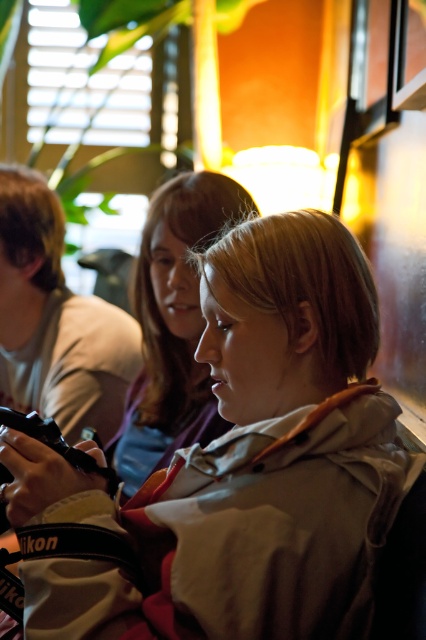
You are a fashion designer observing the scene. You need to determine which piece of clothing is shorter in height between the matte gray jacket at center and the matte beige hoodie at center. Which one is shorter?

The matte gray jacket at center has a lesser height compared to the matte beige hoodie at center, so the matte gray jacket at center is shorter in height.

You are a photographer setting up a shoot in this indoor scene. You need to place a small prop between the matte gray jacket at center and the matte beige hoodie at center. Based on their positions, which jacket should the prop be placed closer to?

The matte gray jacket at center is positioned under the matte beige hoodie at center, so the prop should be placed closer to the matte gray jacket at center since it is lower in position.

You are standing in the scene and want to take a photo of the matte gray jacket at center. Where should you aim your camera to capture it?

You should aim your camera at the coordinates point (x=244, y=465) to capture the matte gray jacket at center.